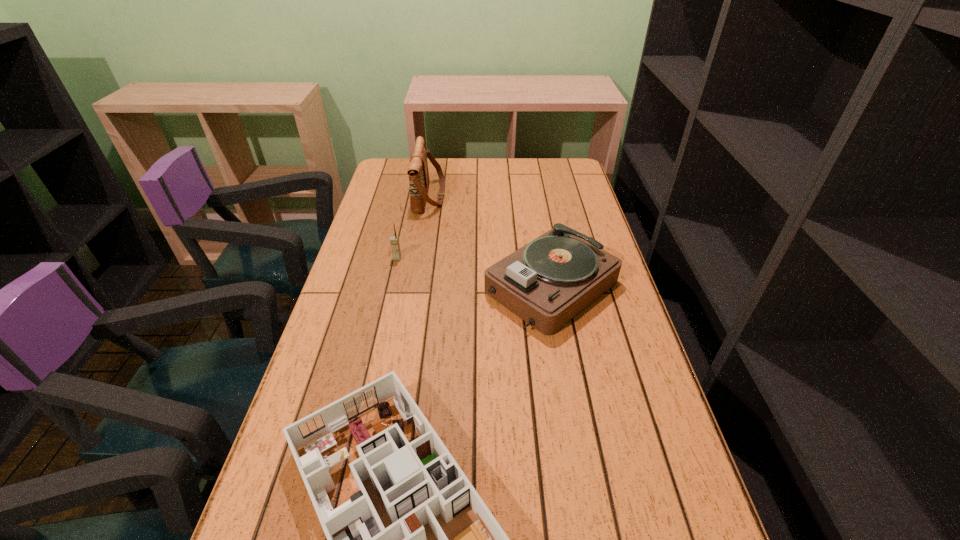
The width and height of the screenshot is (960, 540). What are the coordinates of `vacant area that lies between the tallest object and the cellular telephone` in the screenshot? It's located at (414, 227).

I want to click on object that ranks as the closest to the tallest object, so click(x=394, y=240).

Identify the location of the third closest object to the shortest object. This screenshot has width=960, height=540. (418, 172).

You are a GUI agent. You are given a task and a screenshot of the screen. Output one action in this format:
    pyautogui.click(x=<x>, y=<y>)
    Task: Click on the vacant region that satisfies the following two spatial constraints: 1. on the front-facing side of the tallest object; 2. on the front of the cellular telephone, where the keypad is located
    
    Given the screenshot: What is the action you would take?
    pyautogui.click(x=420, y=259)

Where is `vacant area in the image that satisfies the following two spatial constraints: 1. on the front-facing side of the farthest object; 2. on the right side of the record player`? vacant area in the image that satisfies the following two spatial constraints: 1. on the front-facing side of the farthest object; 2. on the right side of the record player is located at coordinates (415, 287).

Identify the location of vacant space that satisfies the following two spatial constraints: 1. on the front-facing side of the record player; 2. on the left side of the shoulder bag. (415, 287).

The image size is (960, 540). I want to click on free location that satisfies the following two spatial constraints: 1. on the front-facing side of the record player; 2. on the right side of the shoulder bag, so [x=415, y=287].

Locate an element on the screen. Image resolution: width=960 pixels, height=540 pixels. free point that satisfies the following two spatial constraints: 1. on the front-facing side of the record player; 2. on the right side of the tallest object is located at coordinates (415, 287).

This screenshot has height=540, width=960. I want to click on vacant space that satisfies the following two spatial constraints: 1. on the front-facing side of the farthest object; 2. on the front of the cellular telephone, where the keypad is located, so click(x=420, y=259).

At what (x,y) coordinates should I click in order to perform the action: click on vacant position in the image that satisfies the following two spatial constraints: 1. on the front-facing side of the farthest object; 2. on the front of the cellular telephone, where the keypad is located. Please return your answer as a coordinate pair (x, y). Looking at the image, I should click on (420, 259).